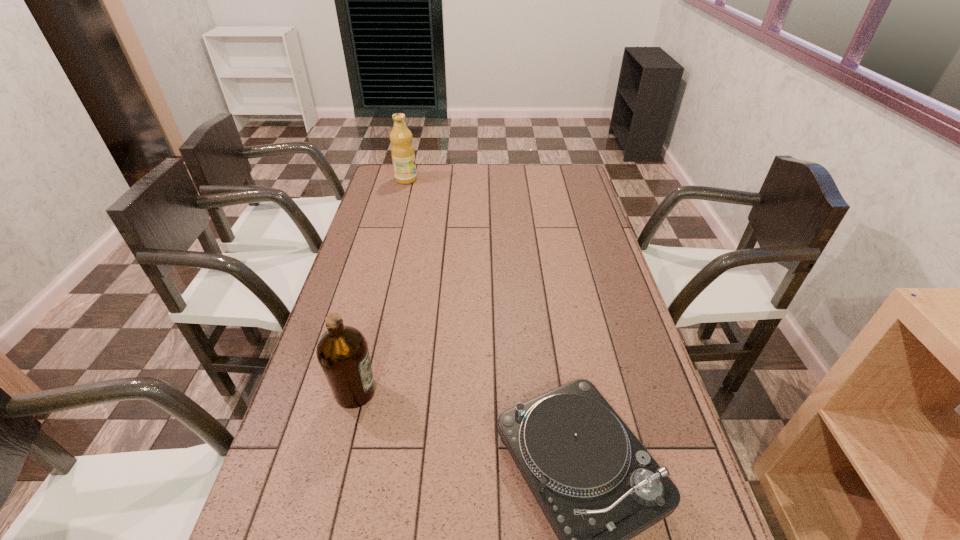
Where is `vacant space that is in between the nearer olive oil and the farther olive oil`? The image size is (960, 540). vacant space that is in between the nearer olive oil and the farther olive oil is located at coordinates (381, 286).

This screenshot has height=540, width=960. In order to click on vacant area between the farthest object and the nearer olive oil in this screenshot , I will do `click(381, 286)`.

Where is `vacant area that lies between the nearer olive oil and the farthest object`? The width and height of the screenshot is (960, 540). vacant area that lies between the nearer olive oil and the farthest object is located at coordinates (381, 286).

Locate an element on the screen. free space between the nearer olive oil and the farther olive oil is located at coordinates (381, 286).

You are a GUI agent. You are given a task and a screenshot of the screen. Output one action in this format:
    pyautogui.click(x=<x>, y=<y>)
    Task: Click on the free space between the nearer olive oil and the farther olive oil
    The width and height of the screenshot is (960, 540).
    Given the screenshot: What is the action you would take?
    (381, 286)

Where is `vacant area that lies between the farthest object and the nearer olive oil`? The width and height of the screenshot is (960, 540). vacant area that lies between the farthest object and the nearer olive oil is located at coordinates (381, 286).

Locate which object ranks in proximity to the nearer olive oil. Please provide its 2D coordinates. Your answer should be formatted as a tuple, i.e. [(x, y)], where the tuple contains the x and y coordinates of a point satisfying the conditions above.

[(597, 485)]

The image size is (960, 540). I want to click on the closest object to the farther olive oil, so [342, 351].